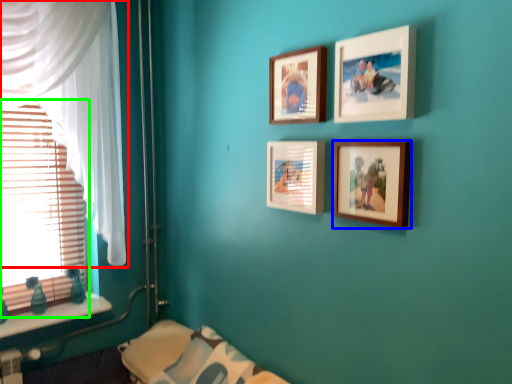
Question: Based on their relative distances, which object is nearer to curtain (highlighted by a red box)? Choose from picture frame (highlighted by a blue box) and window blind (highlighted by a green box).

Choices:
 (A) picture frame
 (B) window blind

Answer: (B)